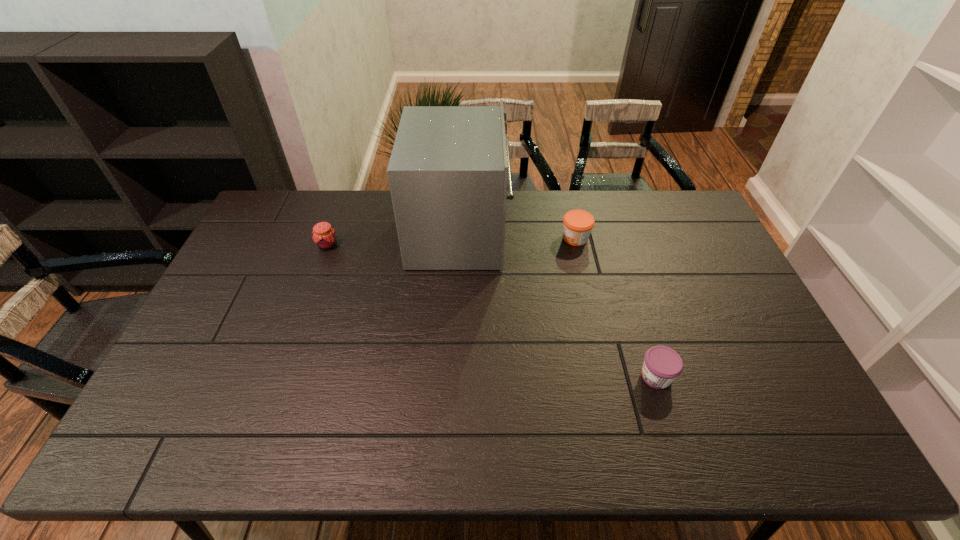
Image resolution: width=960 pixels, height=540 pixels. Identify the location of vacant point located 0.050m on the back of the leftmost jam. (334, 228).

Where is `vacant space located on the front label of the rightmost object`? vacant space located on the front label of the rightmost object is located at coordinates (558, 376).

Locate an element on the screen. The image size is (960, 540). vacant space located 0.080m on the front label of the rightmost object is located at coordinates (608, 376).

Where is `free space located 0.140m on the front label of the rightmost object`? Image resolution: width=960 pixels, height=540 pixels. free space located 0.140m on the front label of the rightmost object is located at coordinates (585, 376).

The width and height of the screenshot is (960, 540). Find the location of `toaster oven positioned at the far edge`. toaster oven positioned at the far edge is located at coordinates (448, 170).

At what (x,y) coordinates should I click in order to perform the action: click on jam present at the far edge. Please return your answer as a coordinate pair (x, y). The image size is (960, 540). Looking at the image, I should click on (577, 224).

Where is `vacant space at the far edge of the desktop`? The width and height of the screenshot is (960, 540). vacant space at the far edge of the desktop is located at coordinates (650, 226).

Identify the location of vacant space at the near edge of the desktop. (393, 441).

What are the coordinates of `vacant space at the left edge of the desktop` in the screenshot? It's located at (253, 259).

Locate an element on the screen. The height and width of the screenshot is (540, 960). free space at the right edge of the desktop is located at coordinates (713, 280).